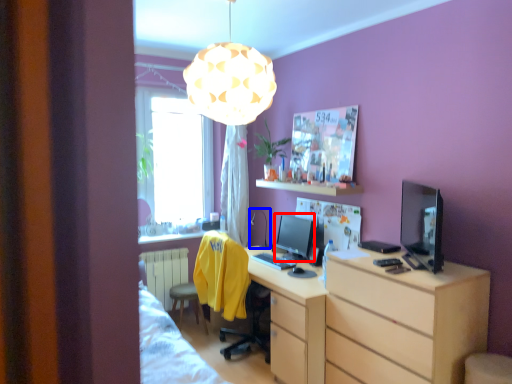
Question: Which of the following is the farthest to the observer, computer monitor (highlighted by a red box) or table lamp (highlighted by a blue box)?

Choices:
 (A) computer monitor
 (B) table lamp

Answer: (B)